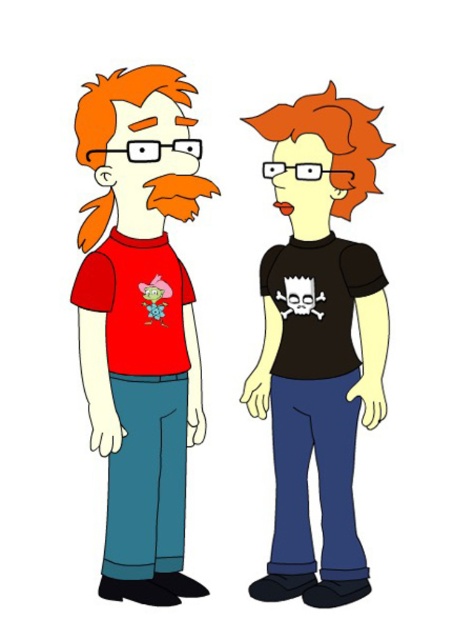
You are looking at the two points in the image, point (147,76) and point (323,301). Which point is closer to you?

Point (147,76) is closer to the viewer than point (323,301).

Please look at the two characters in the image. The point at coordinates (139,326) is located on which character? The one wearing the red T shirt with a cartoonish green alien or the one with the black T shirt and skull design?

The point at coordinates (139,326) is located on the matte red t shirt at left, which belongs to the character wearing the red T shirt with a cartoonish green alien.